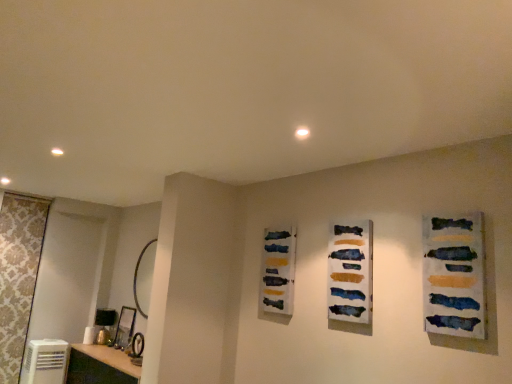
What do you see at coordinates (454, 276) in the screenshot? I see `textured canvas painting at right, which is the 1th art in right-to-left order` at bounding box center [454, 276].

What do you see at coordinates (351, 272) in the screenshot?
I see `watercolor paint strips at center, positioned as the second art in back-to-front order` at bounding box center [351, 272].

Find the location of a particular element. white plastic air conditioner at lower left is located at coordinates (45, 362).

Locate an element on the screen. white glossy vanity at lower left is located at coordinates (100, 366).

At what (x,y) coordinates should I click in order to perform the action: click on gold metallic mirror at left. Please return your answer as a coordinate pair (x, y). This screenshot has width=512, height=384. Looking at the image, I should click on (136, 278).

Identify the location of textured canvas painting at right, which is the 1th art in right-to-left order. pos(454,276).

Is white plastic air conditioner at lower left thinner than textured canvas painting at right, which ranks as the third art in left-to-right order?

Incorrect, the width of white plastic air conditioner at lower left is not less than that of textured canvas painting at right, which ranks as the third art in left-to-right order.

Is textured canvas painting at right, positioned as the third art in back-to-front order, located within white plastic air conditioner at lower left?

Definitely not — textured canvas painting at right, positioned as the third art in back-to-front order, is not inside white plastic air conditioner at lower left.

Can you tell me how much white plastic air conditioner at lower left and textured canvas painting at right, which ranks as the third art in left-to-right order, differ in facing direction?

86.8 degrees.

Is white plastic air conditioner at lower left oriented away from textured canvas painting at right, which is the 1th art in right-to-left order?

white plastic air conditioner at lower left does not have its back to textured canvas painting at right, which is the 1th art in right-to-left order.

From the image's perspective, is watercolor paint strips at center, the 2th art positioned from the right, over white plastic air conditioner at lower left?

Correct, watercolor paint strips at center, the 2th art positioned from the right, appears higher than white plastic air conditioner at lower left in the image.

Considering the positions of objects watercolor paint strips at center, arranged as the second art when viewed from the front, and white plastic air conditioner at lower left in the image provided, who is more to the right, watercolor paint strips at center, arranged as the second art when viewed from the front, or white plastic air conditioner at lower left?

watercolor paint strips at center, arranged as the second art when viewed from the front, is more to the right.

Which is closer, (345, 236) or (34, 348)?

Point (345, 236) is closer to the camera than point (34, 348).

Considering the relative sizes of white glossy vanity at lower left and white plastic air conditioner at lower left in the image provided, is white glossy vanity at lower left shorter than white plastic air conditioner at lower left?

Correct, white glossy vanity at lower left is not as tall as white plastic air conditioner at lower left.

Is white glossy vanity at lower left at the left side of white plastic air conditioner at lower left?

No.

Locate an element on the screen. The width and height of the screenshot is (512, 384). vanity above the white plastic air conditioner at lower left (from the image's perspective) is located at coordinates (100, 366).

How different are the orientations of white glossy vanity at lower left and white plastic air conditioner at lower left in degrees?

white glossy vanity at lower left and white plastic air conditioner at lower left are facing 86.3 degrees away from each other.

From the image's perspective, is white plastic air conditioner at lower left on gold metallic mirror at left?

No, from the image's perspective, white plastic air conditioner at lower left is not on top of gold metallic mirror at left.

Considering the relative sizes of white plastic air conditioner at lower left and gold metallic mirror at left in the image provided, is white plastic air conditioner at lower left smaller than gold metallic mirror at left?

Actually, white plastic air conditioner at lower left might be larger than gold metallic mirror at left.

Is the surface of white plastic air conditioner at lower left in direct contact with gold metallic mirror at left?

white plastic air conditioner at lower left and gold metallic mirror at left are not in contact.

Locate an element on the screen. The width and height of the screenshot is (512, 384). mirror behind the white plastic air conditioner at lower left is located at coordinates (136, 278).

Is the surface of white glossy vanity at lower left in direct contact with watercolor paint palette at center, which is counted as the 3th art, starting from the right?

No, white glossy vanity at lower left is not in contact with watercolor paint palette at center, which is counted as the 3th art, starting from the right.

Is white glossy vanity at lower left located outside watercolor paint palette at center, the 1th art positioned from the back?

Yes, white glossy vanity at lower left is not within watercolor paint palette at center, the 1th art positioned from the back.

Is point (122, 372) closer or farther from the camera than point (268, 247)?

Point (122, 372).

How much distance is there between white glossy vanity at lower left and watercolor paint palette at center, the 1th art positioned from the back?

A distance of 1.84 meters exists between white glossy vanity at lower left and watercolor paint palette at center, the 1th art positioned from the back.

Is watercolor paint strips at center, the 2th art positioned from the right, in contact with watercolor paint palette at center, the 1th art positioned from the back?

No.

Between watercolor paint strips at center, the 2th art from the left, and watercolor paint palette at center, the 1th art positioned from the back, which one has larger size?

Bigger between the two is watercolor paint palette at center, the 1th art positioned from the back.

Relative to watercolor paint palette at center, the 1th art when ordered from left to right, is watercolor paint strips at center, the 2th art from the left, in front or behind?

In the image, watercolor paint strips at center, the 2th art from the left, appears in front of watercolor paint palette at center, the 1th art when ordered from left to right.

I want to click on art on the left of the watercolor paint strips at center, the 2th art positioned from the right, so click(278, 271).

From the image's perspective, would you say textured canvas painting at right, which ranks as the third art in left-to-right order, is shown under white plastic air conditioner at lower left?

No, from the image's perspective, textured canvas painting at right, which ranks as the third art in left-to-right order, is not below white plastic air conditioner at lower left.

Who is bigger, textured canvas painting at right, placed as the first art when sorted from front to back, or white plastic air conditioner at lower left?

With larger size is white plastic air conditioner at lower left.

From a real-world perspective, is textured canvas painting at right, which is the 1th art in right-to-left order, over white plastic air conditioner at lower left?

Correct, in the physical world, textured canvas painting at right, which is the 1th art in right-to-left order, is higher than white plastic air conditioner at lower left.

The image size is (512, 384). There is a white plastic air conditioner at lower left. What are the coordinates of `the 3rd art above it (from a real-world perspective)` in the screenshot? It's located at (454, 276).

In order to click on the 2nd art counting from the right side of the white plastic air conditioner at lower left in this screenshot , I will do `click(351, 272)`.

Which object lies nearer to the anchor point white plastic air conditioner at lower left, gold metallic mirror at left or white glossy vanity at lower left?

The object closer to white plastic air conditioner at lower left is white glossy vanity at lower left.

Considering their positions, is white glossy vanity at lower left positioned further to white plastic air conditioner at lower left than gold metallic mirror at left?

gold metallic mirror at left is further to white plastic air conditioner at lower left.

Considering their positions, is watercolor paint palette at center, the 1th art positioned from the back, positioned further to watercolor paint strips at center, the 2th art positioned from the right, than textured canvas painting at right, placed as the first art when sorted from front to back?

watercolor paint palette at center, the 1th art positioned from the back.

Based on their spatial positions, is gold metallic mirror at left or white plastic air conditioner at lower left further from watercolor paint strips at center, the 2th art from the left?

Based on the image, white plastic air conditioner at lower left appears to be further to watercolor paint strips at center, the 2th art from the left.

Looking at the image, which one is located closer to textured canvas painting at right, which ranks as the third art in left-to-right order, watercolor paint palette at center, marked as the 3th art in a front-to-back arrangement, or gold metallic mirror at left?

Among the two, watercolor paint palette at center, marked as the 3th art in a front-to-back arrangement, is located nearer to textured canvas painting at right, which ranks as the third art in left-to-right order.

When comparing their distances from white plastic air conditioner at lower left, does watercolor paint palette at center, which is counted as the 3th art, starting from the right, or gold metallic mirror at left seem closer?

Among the two, gold metallic mirror at left is located nearer to white plastic air conditioner at lower left.

Which object lies further to the anchor point white plastic air conditioner at lower left, watercolor paint palette at center, which is counted as the 3th art, starting from the right, or watercolor paint strips at center, positioned as the second art in back-to-front order?

watercolor paint strips at center, positioned as the second art in back-to-front order, is positioned further to the anchor white plastic air conditioner at lower left.

Based on the photo, when comparing their distances from white plastic air conditioner at lower left, does gold metallic mirror at left or watercolor paint strips at center, arranged as the second art when viewed from the front, seem further?

watercolor paint strips at center, arranged as the second art when viewed from the front, is positioned further to the anchor white plastic air conditioner at lower left.

At what (x,y) coordinates should I click in order to perform the action: click on vanity situated between white plastic air conditioner at lower left and gold metallic mirror at left from left to right. Please return your answer as a coordinate pair (x, y). Looking at the image, I should click on (100, 366).

Where is `art located between white plastic air conditioner at lower left and watercolor paint strips at center, the 2th art from the left, in the left-right direction`? This screenshot has height=384, width=512. art located between white plastic air conditioner at lower left and watercolor paint strips at center, the 2th art from the left, in the left-right direction is located at coordinates (278, 271).

Where is `mirror situated between white glossy vanity at lower left and watercolor paint strips at center, positioned as the second art in back-to-front order, from left to right`? mirror situated between white glossy vanity at lower left and watercolor paint strips at center, positioned as the second art in back-to-front order, from left to right is located at coordinates (136, 278).

The image size is (512, 384). I want to click on vanity between white plastic air conditioner at lower left and textured canvas painting at right, which is the 1th art in right-to-left order, in the horizontal direction, so click(100, 366).